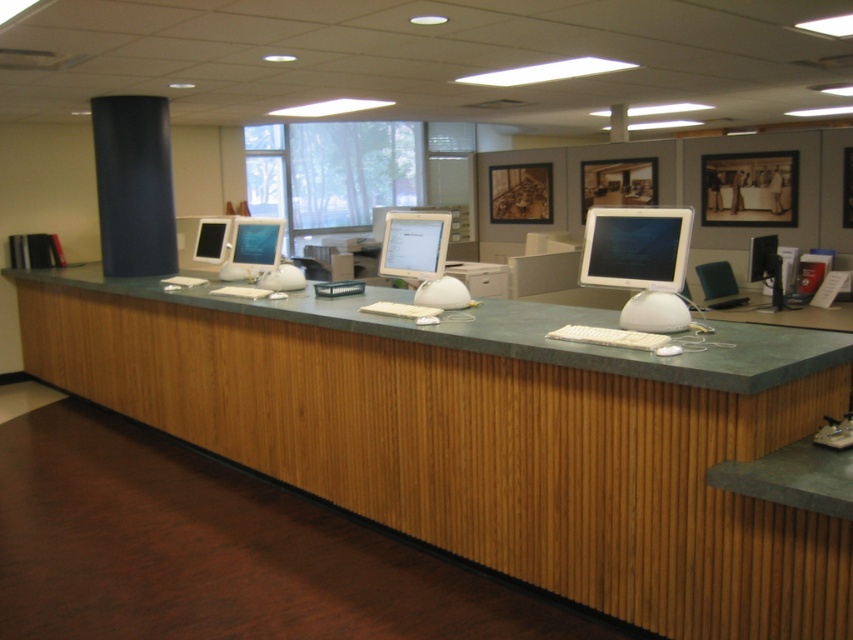
Can you confirm if white glossy monitor at center is smaller than matte silver monitor at center?

Incorrect, white glossy monitor at center is not smaller in size than matte silver monitor at center.

I want to click on white glossy monitor at center, so click(640, 262).

In the scene shown: Which of these two, matte silver monitor at center or matte black monitor at center, stands shorter?

matte black monitor at center is shorter.

Does point (436, 260) come behind point (213, 260)?

No, (436, 260) is closer to viewer.

Locate an element on the screen. Image resolution: width=853 pixels, height=640 pixels. matte silver monitor at center is located at coordinates (415, 244).

Is wooden at center shorter than matte black monitor at center?

No, wooden at center is not shorter than matte black monitor at center.

Locate an element on the screen. wooden at center is located at coordinates [489, 435].

What are the coordinates of `wooden at center` in the screenshot? It's located at (489, 435).